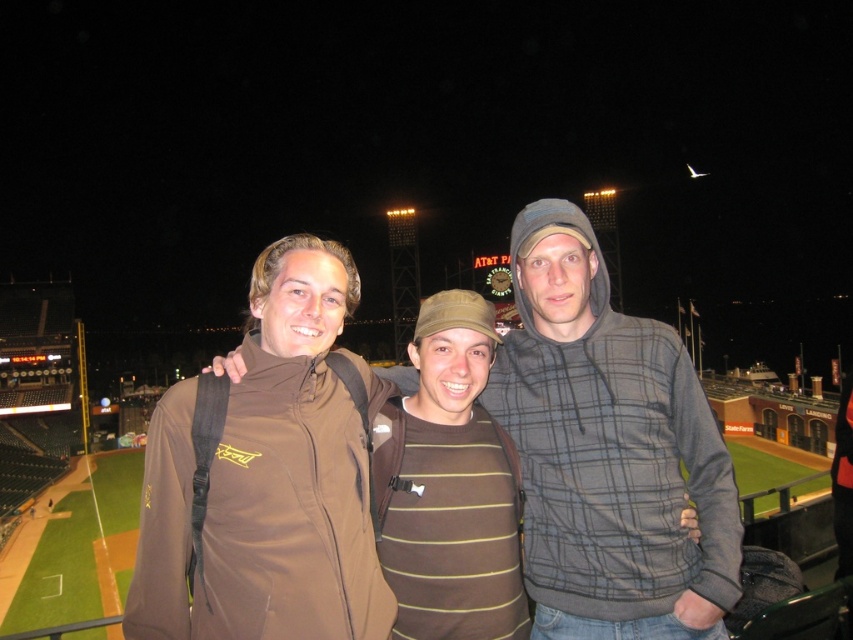
Where is the gray plaid hoodie at center located in the image?

The gray plaid hoodie at center is located at point 0.706 on the x axis and 0.715 on the y axis.

You are trying to find the person wearing the gray plaid hoodie at center in the group photo taken at the baseball stadium. Which direction should you look relative to the person in the brown fabric jacket at center?

The gray plaid hoodie at center is to the right of the brown fabric jacket at center, so you should look to the right of the person in the brown fabric jacket at center to find the gray plaid hoodie at center.